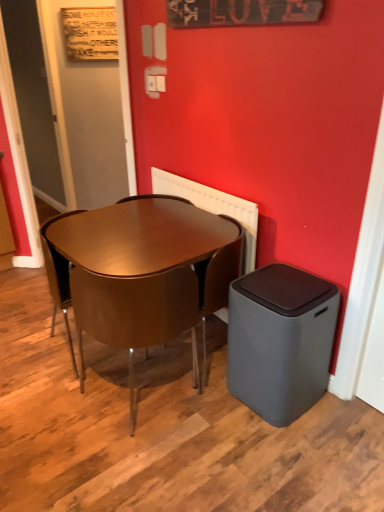
Question: From a real-world perspective, relative to matte brown table at center, is matte gray door at upper left, which is the 2th door in right-to-left order, vertically above or below?

Choices:
 (A) above
 (B) below

Answer: (A)

Question: In terms of width, does matte gray door at upper left, placed as the first door when sorted from left to right, look wider or thinner when compared to matte brown table at center?

Choices:
 (A) thin
 (B) wide

Answer: (A)

Question: Which of these objects is positioned farthest from the white plastic radiator at upper center?

Choices:
 (A) matte brown table at center
 (B) matte gray door at upper left, which is the 2th door in right-to-left order
 (C) glossy brown chair at center, which is counted as the 1th chair, starting from the left
 (D) matte gray door at upper left, the 2th door in the left-to-right sequence
 (E) brown leather chair at center, which is the 2th chair in left-to-right order

Answer: (B)

Question: Based on their relative distances, which object is nearer to the matte brown table at center?

Choices:
 (A) matte gray door at upper left, the 1th door positioned from the right
 (B) matte gray door at upper left, placed as the first door when sorted from left to right
 (C) wooden signboard at upper center, which ranks as the 2th bulletin board in back-to-front order
 (D) wooden signboard at upper left, acting as the 2th bulletin board starting from the right
 (E) white plastic radiator at upper center

Answer: (E)